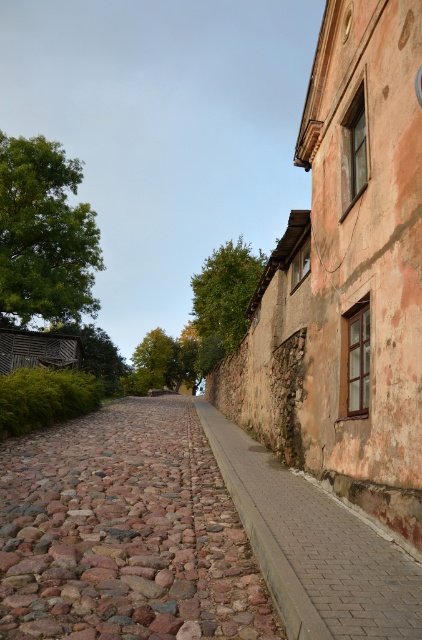
You are standing on the cobblestone street and want to take a photo of both the point at coordinates (213, 534) and the point at coordinates (351, 518). Which point will appear larger in your camera view?

Point (213, 534) is closer to the camera than point (351, 518), so it will appear larger in the photo.

You are a delivery robot with a 1.5 meter wide package. You need to move from the brown rough cobblestone at center to the brick pavement at lower right. Is there enough space for your package to pass through the gap between them?

The distance between the brown rough cobblestone at center and the brick pavement at lower right is 1.77 meters. Since your package is 1.5 meters wide, there is sufficient space for it to pass through the gap.

You are a delivery person carrying a large box that is 1 meter wide. You need to move along the path shown in the image. Can the brown rough cobblestone at center or the brick pavement at lower right accommodate your box?

The brown rough cobblestone at center has a greater width than the brick pavement at lower right. Since the box is 1 meter wide, it can fit on the brown rough cobblestone at center but may not fit on the narrower brick pavement at lower right.